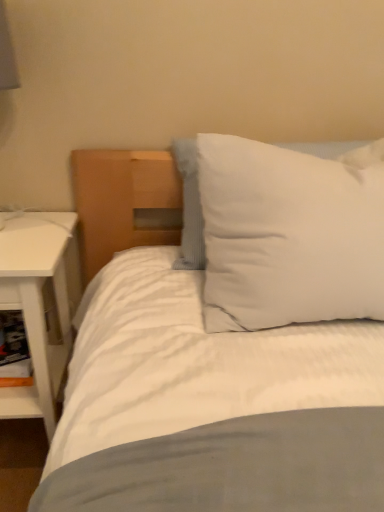
Question: From the image's perspective, is white matte nightstand at left under white soft pillow at upper right?

Choices:
 (A) no
 (B) yes

Answer: (B)

Question: Considering the relative sizes of white matte nightstand at left and white soft pillow at upper right in the image provided, is white matte nightstand at left smaller than white soft pillow at upper right?

Choices:
 (A) yes
 (B) no

Answer: (B)

Question: Is white matte nightstand at left positioned with its back to white soft pillow at upper right?

Choices:
 (A) no
 (B) yes

Answer: (A)

Question: Does white matte nightstand at left have a lesser width compared to white soft pillow at upper right?

Choices:
 (A) no
 (B) yes

Answer: (A)

Question: Would you say white matte nightstand at left is a long distance from white soft pillow at upper right?

Choices:
 (A) yes
 (B) no

Answer: (B)

Question: In the image, is white matte nightstand at left positioned in front of or behind white cardboard shelf at lower left?

Choices:
 (A) behind
 (B) front

Answer: (B)

Question: From their relative heights in the image, would you say white matte nightstand at left is taller or shorter than white cardboard shelf at lower left?

Choices:
 (A) short
 (B) tall

Answer: (B)

Question: From a real-world perspective, is white matte nightstand at left positioned above or below white cardboard shelf at lower left?

Choices:
 (A) below
 (B) above

Answer: (B)

Question: Is point (23, 212) positioned closer to the camera than point (8, 350)?

Choices:
 (A) closer
 (B) farther

Answer: (A)

Question: In terms of height, does white cardboard shelf at lower left look taller or shorter compared to white matte nightstand at left?

Choices:
 (A) short
 (B) tall

Answer: (A)

Question: From a real-world perspective, is white cardboard shelf at lower left positioned above or below white matte nightstand at left?

Choices:
 (A) below
 (B) above

Answer: (A)

Question: Choose the correct answer: Is white cardboard shelf at lower left inside white matte nightstand at left or outside it?

Choices:
 (A) outside
 (B) inside

Answer: (B)

Question: From the image's perspective, is white cardboard shelf at lower left above or below white matte nightstand at left?

Choices:
 (A) above
 (B) below

Answer: (B)

Question: In the image, is white matte nightstand at left positioned in front of or behind white soft pillow at upper right?

Choices:
 (A) behind
 (B) front

Answer: (A)

Question: From the image's perspective, is white matte nightstand at left above or below white soft pillow at upper right?

Choices:
 (A) above
 (B) below

Answer: (B)